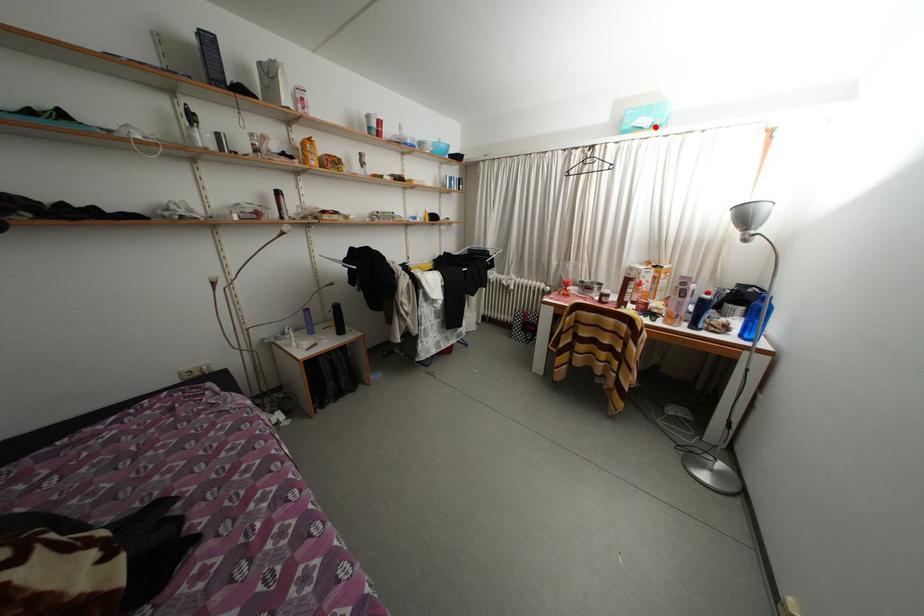
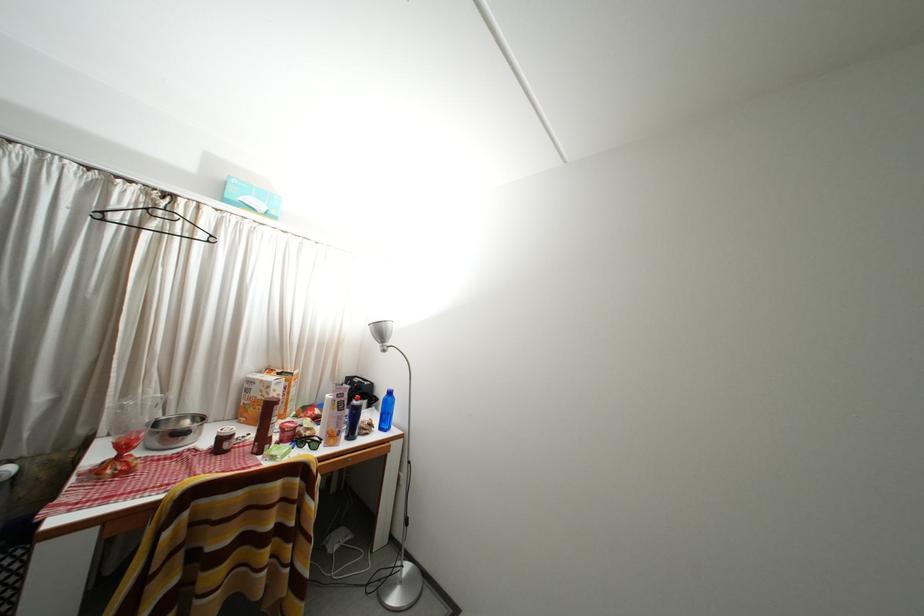
Where in the second image is the point corresponding to the highlighted location from the first image?

(268, 211)